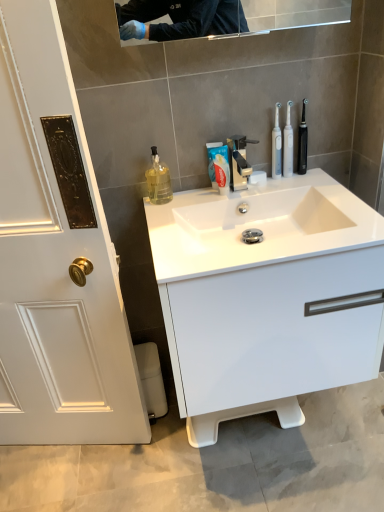
Locate an element on the screen. unoccupied region to the right of polished chrome faucet at center is located at coordinates (x=286, y=193).